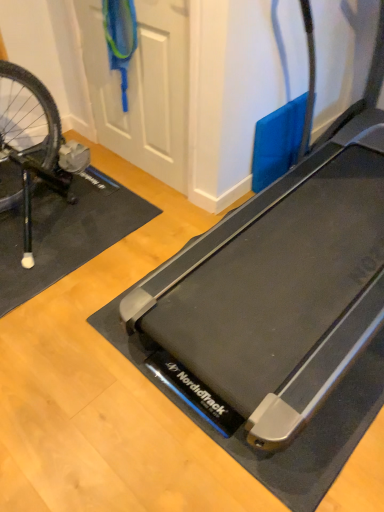
The height and width of the screenshot is (512, 384). Identify the location of empty space that is ontop of black rubber yoga mat at left (from a real-world perspective). (68, 218).